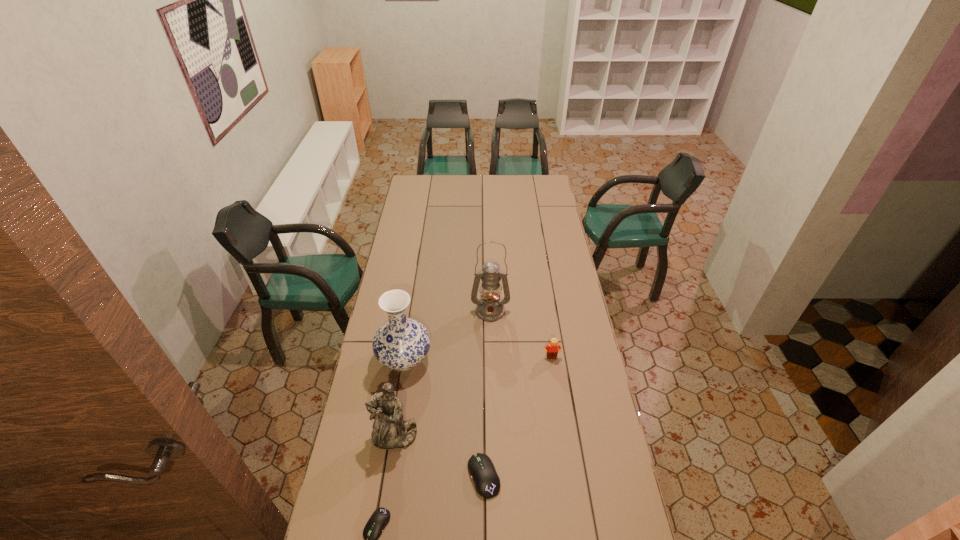
Where is `the fifth tallest object`? Image resolution: width=960 pixels, height=540 pixels. the fifth tallest object is located at coordinates (487, 483).

Where is `the right computer equipment`? The width and height of the screenshot is (960, 540). the right computer equipment is located at coordinates (487, 483).

Where is `the farthest object`? the farthest object is located at coordinates (490, 307).

Find the location of a particular element. the second tallest object is located at coordinates (401, 343).

The image size is (960, 540). What are the coordinates of `the fourth tallest object` in the screenshot? It's located at (552, 350).

Identify the location of Lego. (552, 350).

Identify the location of the fourth farthest object. click(x=390, y=431).

What are the coordinates of `the third tallest object` in the screenshot? It's located at (390, 431).

The image size is (960, 540). Identify the location of vacant space located on the left of the taller computer equipment. (430, 476).

Find the location of a particular element. free space located on the front of the farthest object is located at coordinates (492, 399).